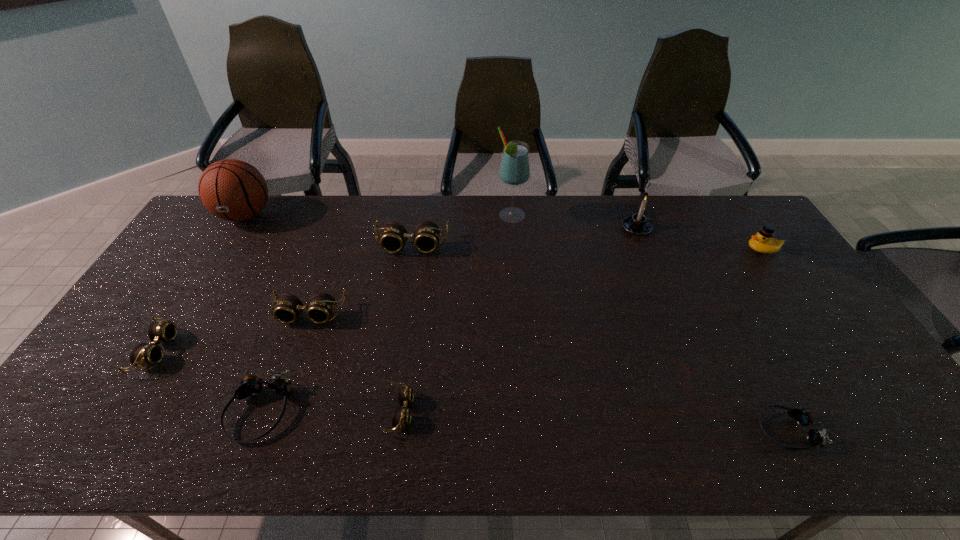
The height and width of the screenshot is (540, 960). What are the coordinates of `vacant space located through the lenses of the ninth object from left to right` in the screenshot? It's located at (729, 430).

Locate an element on the screen. The height and width of the screenshot is (540, 960). alcohol situated at the far edge is located at coordinates pos(514,170).

Image resolution: width=960 pixels, height=540 pixels. I want to click on basketball located in the far edge section of the desktop, so click(233, 190).

This screenshot has width=960, height=540. Identify the location of candle holder present at the far edge. (638, 224).

The image size is (960, 540). Identify the location of goggles present at the far edge. (426, 235).

Image resolution: width=960 pixels, height=540 pixels. In order to click on basketball at the left edge in this screenshot , I will do `click(233, 190)`.

Where is `goggles present at the left edge`? goggles present at the left edge is located at coordinates (143, 354).

Where is `object present at the right edge`? object present at the right edge is located at coordinates (763, 242).

This screenshot has height=540, width=960. I want to click on object that is at the far left corner, so click(x=233, y=190).

I want to click on vacant space at the far edge of the desktop, so click(624, 214).